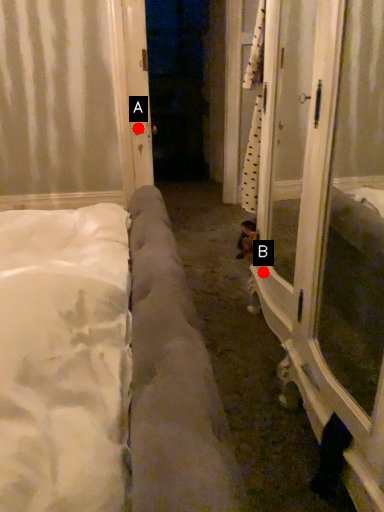
Question: Two points are circled on the image, labeled by A and B beside each circle. Among these points, which one is nearest to the camera?

Choices:
 (A) A is closer
 (B) B is closer

Answer: (B)